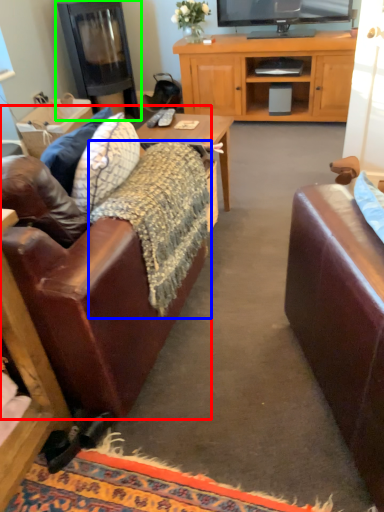
Question: Considering the real-world distances, which object is farthest from studio couch (highlighted by a red box)? blanket (highlighted by a blue box) or fireplace (highlighted by a green box)?

Choices:
 (A) blanket
 (B) fireplace

Answer: (B)